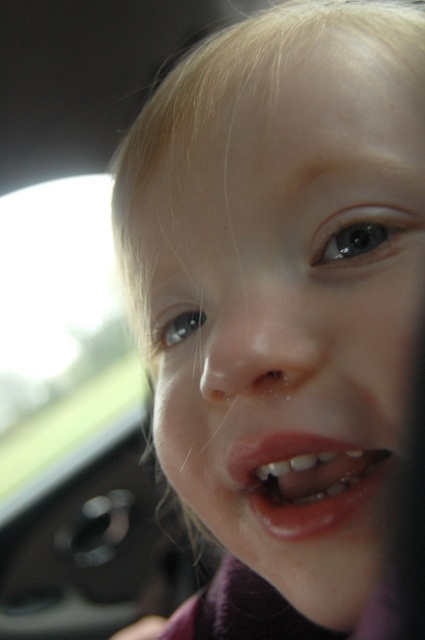
Question: Does smooth skin face at center have a lesser width compared to pink glossy lips at center?

Choices:
 (A) no
 (B) yes

Answer: (A)

Question: From the image, what is the correct spatial relationship of smooth skin face at center in relation to pink glossy lips at center?

Choices:
 (A) right
 (B) left

Answer: (B)

Question: Which of the following is the farthest from the observer?

Choices:
 (A) (346, 496)
 (B) (376, 83)

Answer: (B)

Question: Observing the image, what is the correct spatial positioning of smooth skin face at center in reference to pink glossy lips at center?

Choices:
 (A) below
 (B) above

Answer: (B)

Question: Which point is farther to the camera?

Choices:
 (A) (258, 518)
 (B) (404, 188)

Answer: (A)